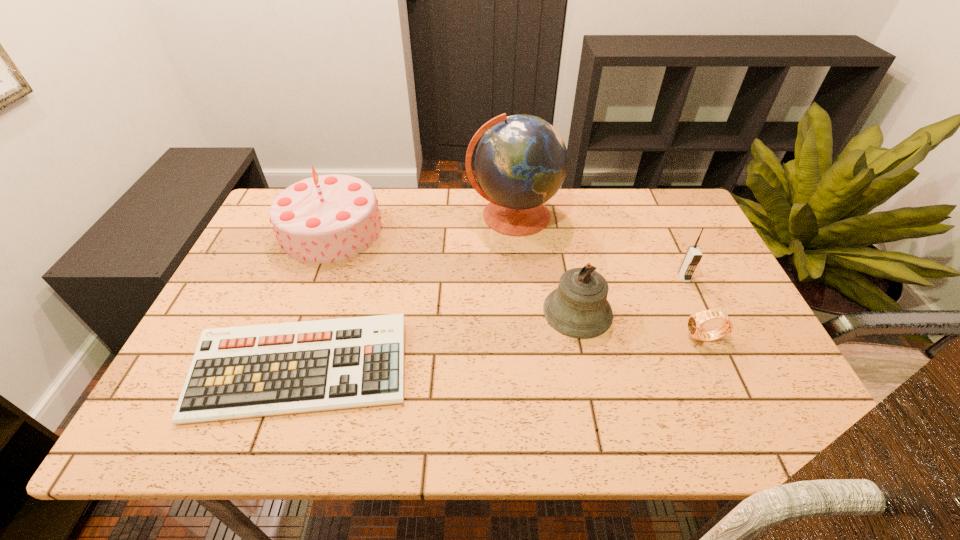
Locate an element on the screen. The width and height of the screenshot is (960, 540). watch that is at the right edge is located at coordinates (695, 323).

This screenshot has height=540, width=960. Identify the location of object located at the far left corner. (328, 218).

Locate an element on the screen. This screenshot has width=960, height=540. object at the near left corner is located at coordinates (248, 371).

In the image, there is a desktop. At what (x,y) coordinates should I click in order to perform the action: click on vacant space at the far edge. Please return your answer as a coordinate pair (x, y). Image resolution: width=960 pixels, height=540 pixels. Looking at the image, I should click on (619, 217).

This screenshot has height=540, width=960. I want to click on vacant space at the left edge of the desktop, so click(x=274, y=318).

You are a GUI agent. You are given a task and a screenshot of the screen. Output one action in this format:
    pyautogui.click(x=<x>, y=<y>)
    Task: Click on the vacant space at the right edge of the desktop
    The height and width of the screenshot is (540, 960).
    Given the screenshot: What is the action you would take?
    pyautogui.click(x=711, y=261)

I want to click on free space at the far right corner of the desktop, so click(640, 199).

You are a GUI agent. You are given a task and a screenshot of the screen. Output one action in this format:
    pyautogui.click(x=<x>, y=<y>)
    Task: Click on the vacant space that is in between the fifth tallest object and the computer keyboard
    The height and width of the screenshot is (540, 960).
    Given the screenshot: What is the action you would take?
    pyautogui.click(x=503, y=354)

The height and width of the screenshot is (540, 960). Identify the location of vacant area that lies between the globe and the shortest object. (407, 292).

Where is `empty location between the computer keyboard and the tallest object`? The width and height of the screenshot is (960, 540). empty location between the computer keyboard and the tallest object is located at coordinates (407, 292).